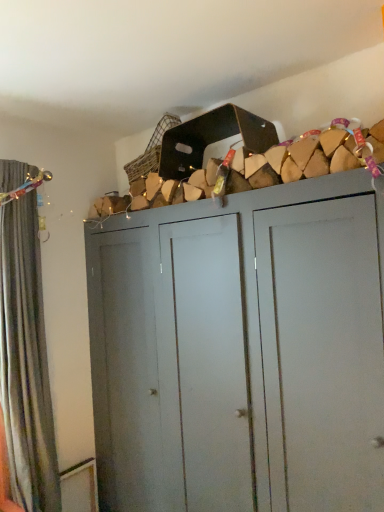
Question: Is velvet dark grey curtain at left spatially inside matte gray cupboard at center, or outside of it?

Choices:
 (A) inside
 (B) outside

Answer: (B)

Question: In terms of height, does velvet dark grey curtain at left look taller or shorter compared to matte gray cupboard at center?

Choices:
 (A) short
 (B) tall

Answer: (A)

Question: In the image, is velvet dark grey curtain at left positioned in front of or behind matte gray cupboard at center?

Choices:
 (A) behind
 (B) front

Answer: (A)

Question: Relative to velvet dark grey curtain at left, is matte gray cupboard at center in front or behind?

Choices:
 (A) behind
 (B) front

Answer: (B)

Question: Is matte gray cupboard at center wider or thinner than velvet dark grey curtain at left?

Choices:
 (A) thin
 (B) wide

Answer: (B)

Question: From a real-world perspective, is matte gray cupboard at center above or below velvet dark grey curtain at left?

Choices:
 (A) above
 (B) below

Answer: (B)

Question: From their relative heights in the image, would you say matte gray cupboard at center is taller or shorter than velvet dark grey curtain at left?

Choices:
 (A) short
 (B) tall

Answer: (B)